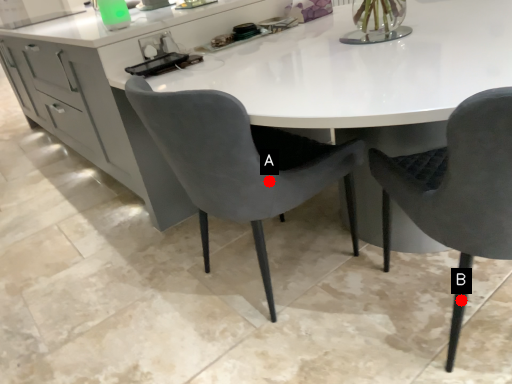
Question: Two points are circled on the image, labeled by A and B beside each circle. Which of the following is the farthest from the observer?

Choices:
 (A) A is further
 (B) B is further

Answer: (A)